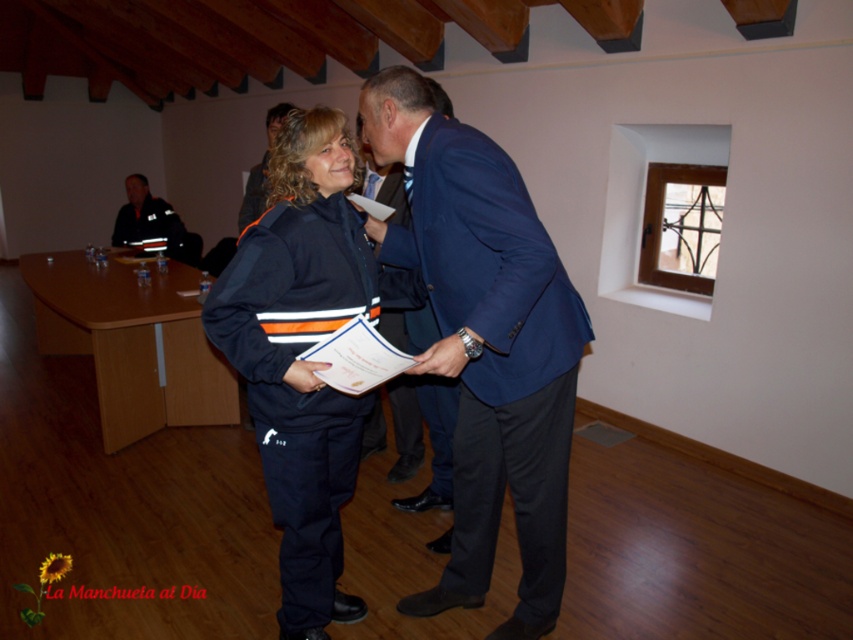
You are standing in the room and want to place a small decorative item exactly at the position where the blue fabric suit at center is located. What coordinates should you use?

The coordinates for the blue fabric suit at center are at point (x=495, y=364).

In the scene shown: You are an event planner organizing a photoshoot in this room. You need to position the blue fabric suit at center and the navy blue jacket at center so that both are visible in the frame. Given their sizes, which one should you place closer to the camera to ensure both are fully visible?

The blue fabric suit at center is much taller than the navy blue jacket at center, so to ensure both are fully visible in the frame, place the navy blue jacket at center closer to the camera.

You are an event planner organizing a ceremony and need to arrange seating based on the attendees. The navy blue uniform at center and reflective black uniform at upper left are both present. Which attendee should be seated closer to the stage to ensure visibility given their uniform sizes?

The navy blue uniform at center should be seated closer to the stage because it is larger in size than the reflective black uniform at upper left, ensuring better visibility for all attendees.